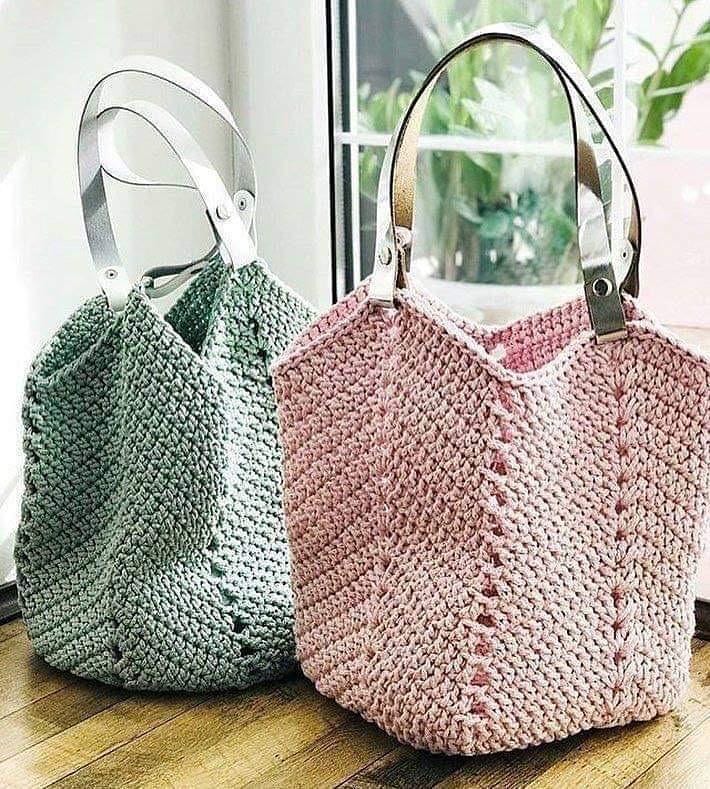
I want to click on wooden floor, so click(x=226, y=780).